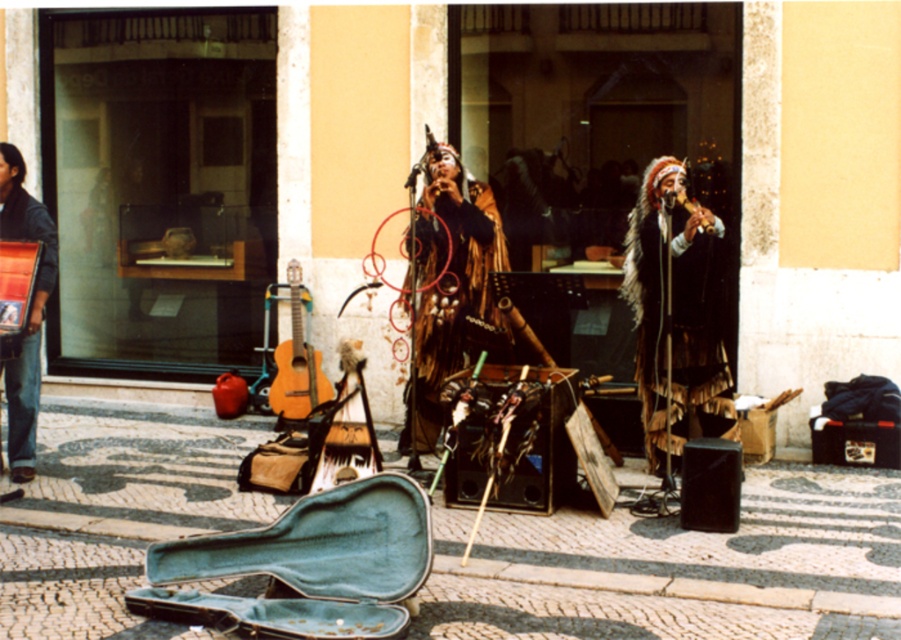
Which of these two, fur-like costume at center or brushed metal accordion at lower left, stands taller?

Standing taller between the two is brushed metal accordion at lower left.

Is point (724, 387) positioned in front of point (47, 224)?

Yes, point (724, 387) is in front of point (47, 224).

Which is in front, point (649, 426) or point (23, 436)?

Point (649, 426)

You are a GUI agent. You are given a task and a screenshot of the screen. Output one action in this format:
    pyautogui.click(x=<x>, y=<y>)
    Task: Click on the fur-like costume at center
    The height and width of the screenshot is (640, 901).
    Given the screenshot: What is the action you would take?
    pyautogui.click(x=672, y=307)

Based on the photo, who is higher up, fur-like costume at center or light brown wooden guitar at center?

fur-like costume at center is above.

Who is more forward, (x=714, y=236) or (x=302, y=404)?

Positioned in front is point (x=714, y=236).

The width and height of the screenshot is (901, 640). What are the coordinates of `fur-like costume at center` in the screenshot? It's located at (672, 307).

This screenshot has width=901, height=640. What do you see at coordinates (680, 566) in the screenshot? I see `cobblestone pavement at center` at bounding box center [680, 566].

Is cobblestone pavement at center to the right of fur-like brown coat at center from the viewer's perspective?

Yes, cobblestone pavement at center is to the right of fur-like brown coat at center.

Is point (727, 586) behind point (414, 404)?

No, it is not.

I want to click on cobblestone pavement at center, so click(x=680, y=566).